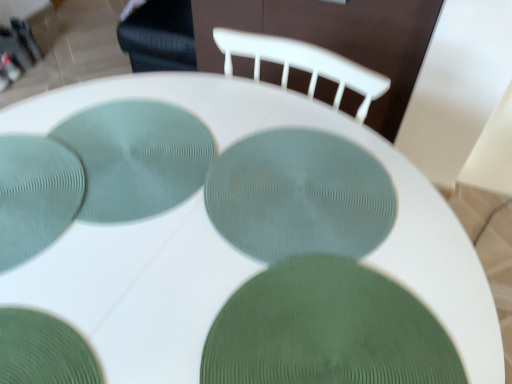
Image resolution: width=512 pixels, height=384 pixels. In order to click on free space between green textured plate at center, the 5th glass plate positioned from the left, and matte green plate at center, acting as the fourth glass plate starting from the left in this screenshot , I will do `click(285, 267)`.